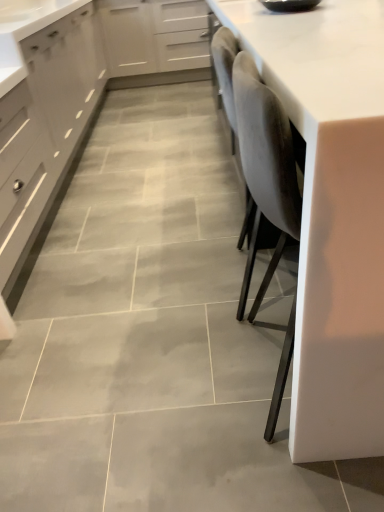
Question: Is matte gray drawer at left taller or shorter than matte gray cabinet at left, acting as the second cabinetry starting from the right?

Choices:
 (A) short
 (B) tall

Answer: (A)

Question: Considering the positions of matte gray drawer at left and matte gray cabinet at left, which ranks as the 1th cabinetry in left-to-right order, in the image, is matte gray drawer at left wider or thinner than matte gray cabinet at left, which ranks as the 1th cabinetry in left-to-right order,?

Choices:
 (A) thin
 (B) wide

Answer: (A)

Question: Which object is positioned farthest from the matte gray cabinet at left, which ranks as the 1th cabinetry in left-to-right order?

Choices:
 (A) white glossy countertop at right
 (B) matte gray drawer at left
 (C) white matte cabinet at upper center, the first cabinetry viewed from the right

Answer: (A)

Question: Which of these objects is positioned closest to the matte gray drawer at left?

Choices:
 (A) white glossy countertop at right
 (B) matte gray cabinet at left, acting as the second cabinetry starting from the right
 (C) white matte cabinet at upper center, the first cabinetry viewed from the right

Answer: (B)